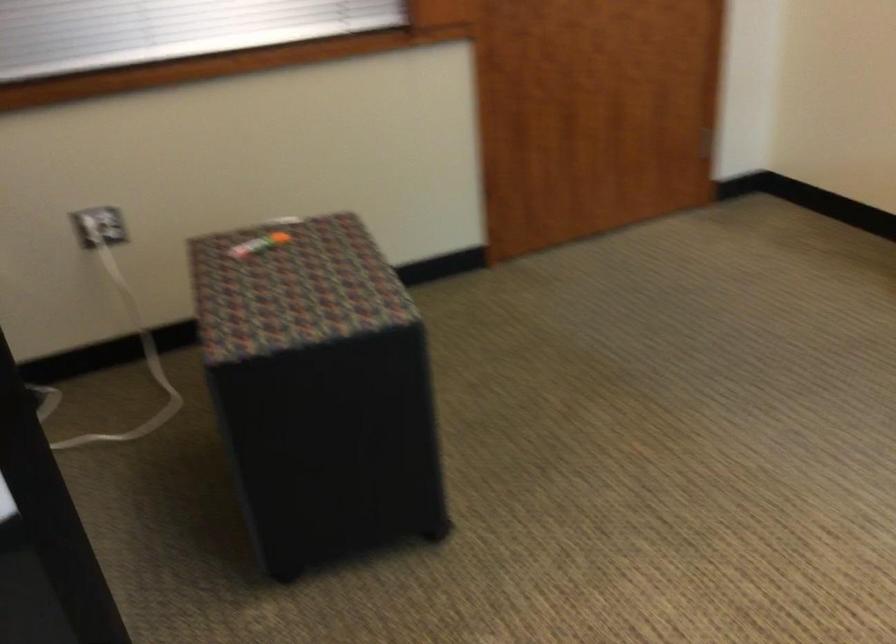
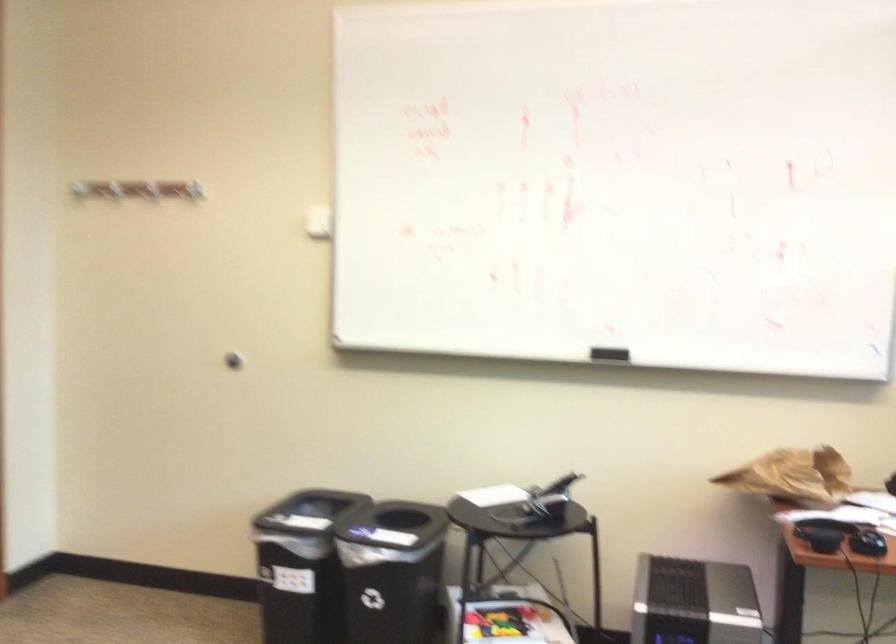
First-person continuous shooting, in which direction is the camera rotating?

The camera's rotation is toward right-up.